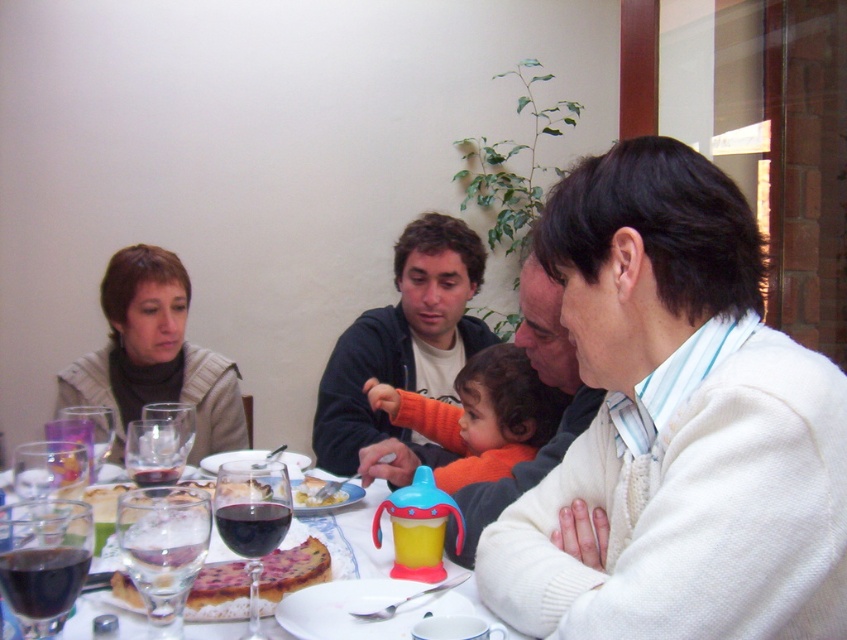
Does foamy glass at lower left have a lesser height compared to translucent glass tableware at center?

Incorrect, foamy glass at lower left's height does not fall short of translucent glass tableware at center's.

Is the position of foamy glass at lower left more distant than that of translucent glass tableware at center?

No, it is in front of translucent glass tableware at center.

You are a GUI agent. You are given a task and a screenshot of the screen. Output one action in this format:
    pyautogui.click(x=<x>, y=<y>)
    Task: Click on the foamy glass at lower left
    
    Given the screenshot: What is the action you would take?
    pyautogui.click(x=163, y=548)

Is point (383, 417) less distant than point (109, 420)?

That is False.

Does dark blue hoodie at center have a lesser height compared to clear glass wine glass at table left?

Incorrect, dark blue hoodie at center's height does not fall short of clear glass wine glass at table left's.

Is point (378, 428) positioned behind point (97, 456)?

That is True.

At what (x,y) coordinates should I click in order to perform the action: click on dark blue hoodie at center. Please return your answer as a coordinate pair (x, y). The height and width of the screenshot is (640, 847). Looking at the image, I should click on [403, 340].

In the scene shown: Who is lower down, knitted beige sweater at left or transparent glass at lower left?

Positioned lower is transparent glass at lower left.

Locate an element on the screen. The height and width of the screenshot is (640, 847). knitted beige sweater at left is located at coordinates (154, 355).